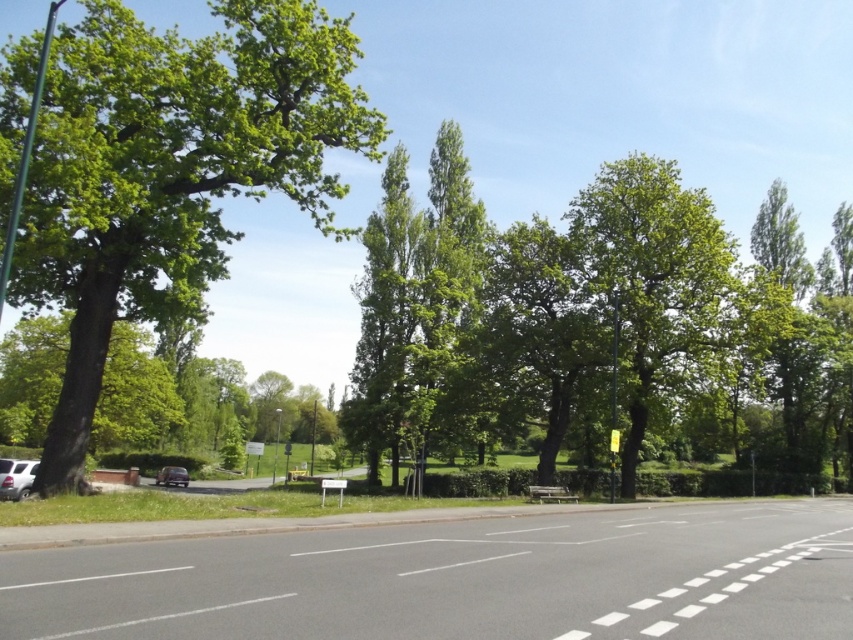
You are driving a shiny black car at center and want to make a U turn on the road. Considering the green leafy tree at center is in front of your car, can you see the road ahead clearly to safely perform the U turn?

The green leafy tree at center is in front of the shiny black car at center, which may block the driver from seeing the road ahead clearly, making it unsafe to perform the U turn.